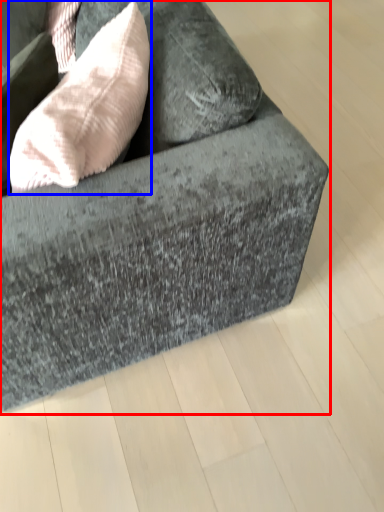
Question: Which object is further to the camera taking this photo, studio couch (highlighted by a red box) or throw pillow (highlighted by a blue box)?

Choices:
 (A) studio couch
 (B) throw pillow

Answer: (B)